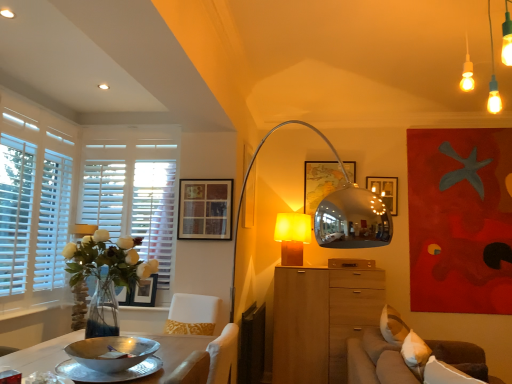
Question: Considering the positions of matte black picture frame at upper center, which ranks as the third picture frame in top-to-bottom order, and white wooden blinds at left in the image, is matte black picture frame at upper center, which ranks as the third picture frame in top-to-bottom order, wider or thinner than white wooden blinds at left?

Choices:
 (A) wide
 (B) thin

Answer: (B)

Question: Is point (147, 289) positioned closer to the camera than point (24, 114)?

Choices:
 (A) farther
 (B) closer

Answer: (A)

Question: Based on their relative distances, which object is nearer to the white wood at lower left?

Choices:
 (A) wooden cabinet at center
 (B) matte black picture frame at upper center, which is the 2th picture frame in back-to-front order
 (C) matte yellow glass lampshade at center
 (D) silver metallic bowl at lower left
 (E) white wood window frame at left

Answer: (B)

Question: Estimate the real-world distances between objects in this image. Which object is farther from the white wood window frame at left?

Choices:
 (A) silver metallic bowl at lower left
 (B) matte yellow glass lampshade at center
 (C) wooden drawer at center
 (D) white wooden blinds at left
 (E) wooden picture frame at center, which is the third picture frame from bottom to top

Answer: (E)